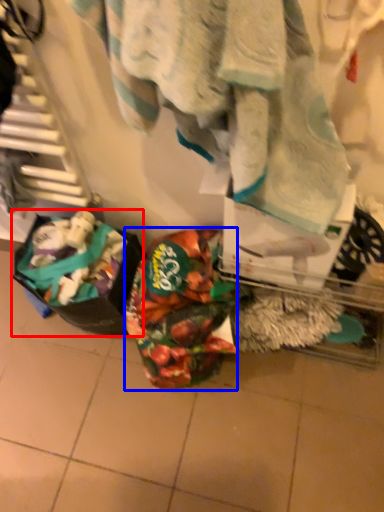
Question: Which of the following is the farthest to the observer, waste (highlighted by a red box) or waste (highlighted by a blue box)?

Choices:
 (A) waste
 (B) waste

Answer: (B)